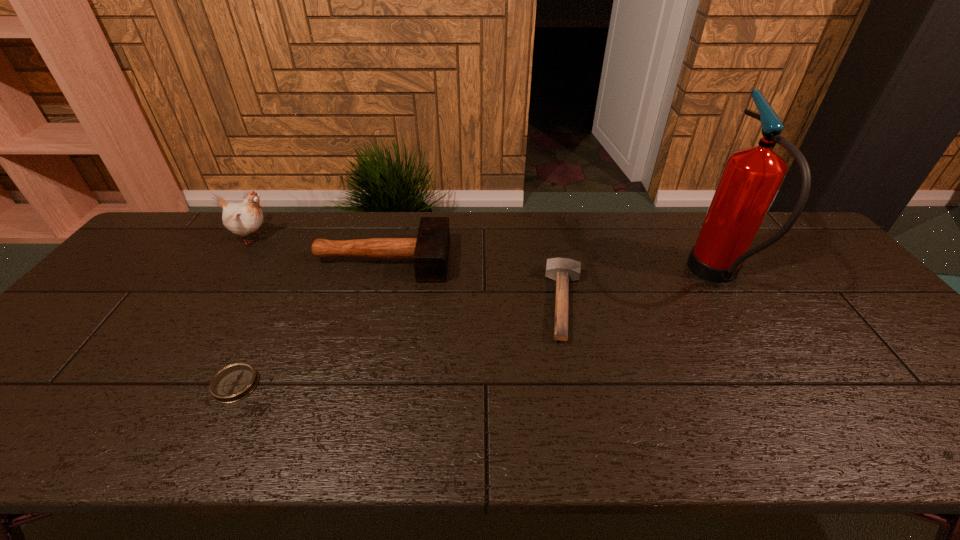
Locate an element on the screen. This screenshot has height=540, width=960. free space at the left edge of the desktop is located at coordinates (124, 334).

At what (x,y) coordinates should I click in order to perform the action: click on vacant space at the right edge of the desktop. Please return your answer as a coordinate pair (x, y). The width and height of the screenshot is (960, 540). Looking at the image, I should click on (806, 264).

The height and width of the screenshot is (540, 960). In order to click on vacant area at the far left corner of the desktop in this screenshot , I will do `click(189, 225)`.

I want to click on free space at the near left corner of the desktop, so click(x=34, y=431).

Where is `vacant region at the far right corner of the desktop`? Image resolution: width=960 pixels, height=540 pixels. vacant region at the far right corner of the desktop is located at coordinates (x=783, y=214).

The height and width of the screenshot is (540, 960). Find the location of `free space between the second object from right to left and the third shortest object`. free space between the second object from right to left and the third shortest object is located at coordinates (474, 281).

Locate an element on the screen. free space between the rightmost object and the second object from left to right is located at coordinates (476, 330).

You are a GUI agent. You are given a task and a screenshot of the screen. Output one action in this format:
    pyautogui.click(x=<x>, y=<y>)
    Task: Click on the free area in between the second tallest object and the second shortest object
    The width and height of the screenshot is (960, 540).
    Given the screenshot: What is the action you would take?
    pyautogui.click(x=410, y=270)

Where is `blank region between the fourth tallest object and the left mallet`? blank region between the fourth tallest object and the left mallet is located at coordinates (474, 281).

Where is `free space between the compass and the rightmost object`? The image size is (960, 540). free space between the compass and the rightmost object is located at coordinates (476, 330).